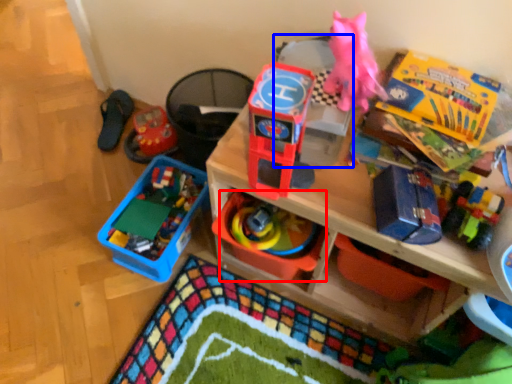
Question: Which point is further to the camera, toy (highlighted by a red box) or storage box (highlighted by a blue box)?

Choices:
 (A) toy
 (B) storage box

Answer: (A)